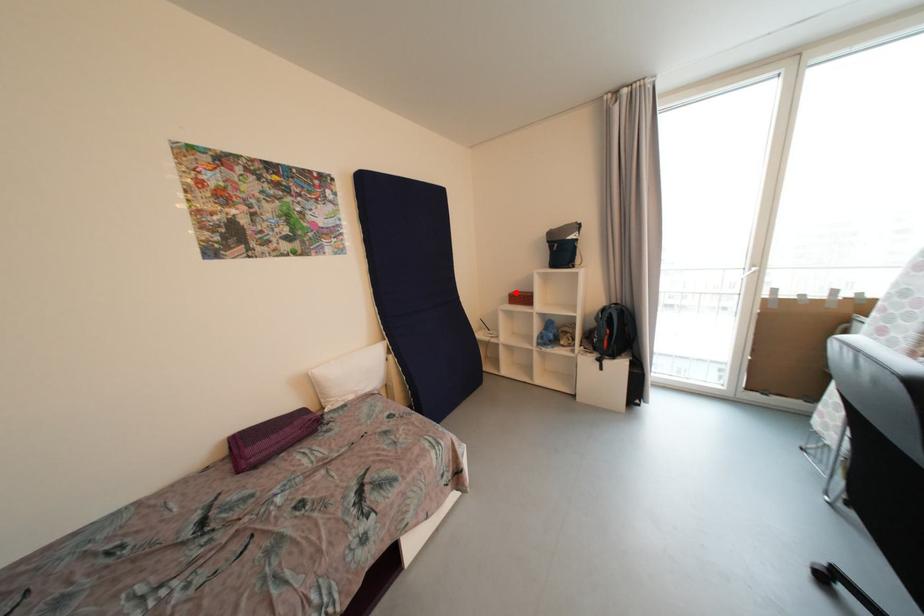
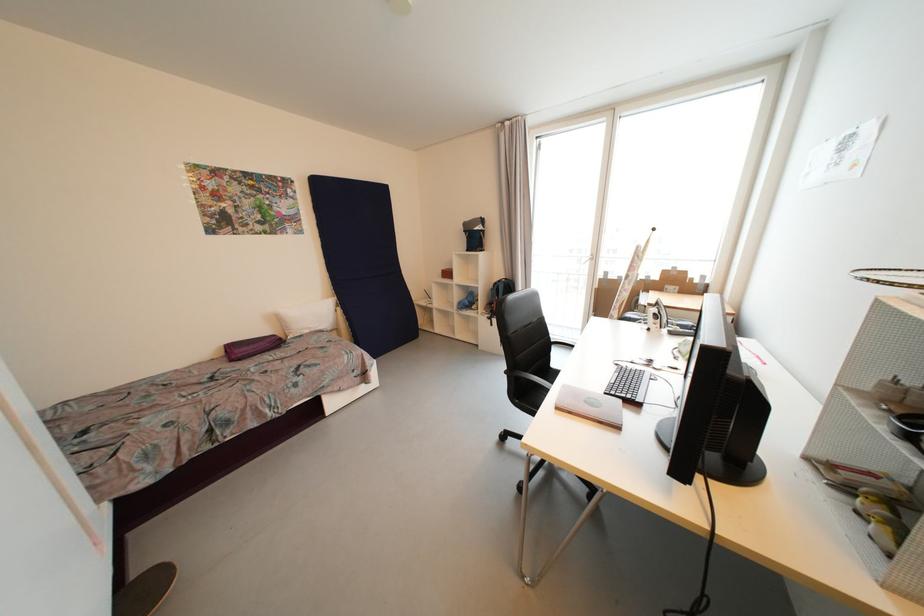
In the second image, find the point that corresponds to the highlighted location in the first image.

(450, 270)